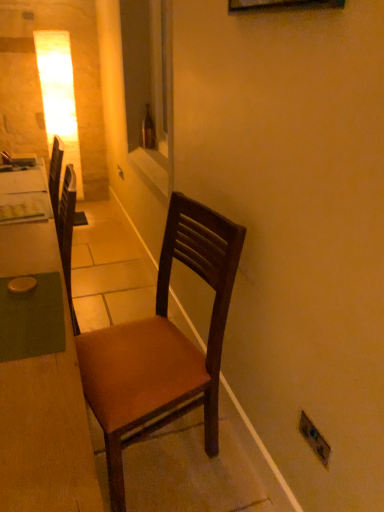
Question: Is brown leather chair at center further to camera compared to matte plastic electric outlet at lower right?

Choices:
 (A) no
 (B) yes

Answer: (A)

Question: From the image's perspective, is brown leather chair at center above matte plastic electric outlet at lower right?

Choices:
 (A) no
 (B) yes

Answer: (B)

Question: Can you confirm if brown leather chair at center is taller than matte plastic electric outlet at lower right?

Choices:
 (A) no
 (B) yes

Answer: (B)

Question: Does brown leather chair at center have a greater width compared to matte plastic electric outlet at lower right?

Choices:
 (A) yes
 (B) no

Answer: (A)

Question: Is brown leather chair at center shorter than matte plastic electric outlet at lower right?

Choices:
 (A) no
 (B) yes

Answer: (A)

Question: Is brown leather chair at center positioned in front of matte plastic electric outlet at lower right?

Choices:
 (A) no
 (B) yes

Answer: (B)

Question: From the image's perspective, is white glossy window sill at center under matte plastic electric outlet at lower right?

Choices:
 (A) no
 (B) yes

Answer: (A)

Question: Considering the relative sizes of white glossy window sill at center and matte plastic electric outlet at lower right in the image provided, is white glossy window sill at center taller than matte plastic electric outlet at lower right?

Choices:
 (A) yes
 (B) no

Answer: (B)

Question: Is white glossy window sill at center oriented away from matte plastic electric outlet at lower right?

Choices:
 (A) yes
 (B) no

Answer: (B)

Question: Is white glossy window sill at center positioned beyond the bounds of matte plastic electric outlet at lower right?

Choices:
 (A) yes
 (B) no

Answer: (A)

Question: Is white glossy window sill at center bigger than matte plastic electric outlet at lower right?

Choices:
 (A) no
 (B) yes

Answer: (B)

Question: From the image's perspective, is white glossy window sill at center on top of matte plastic electric outlet at lower right?

Choices:
 (A) no
 (B) yes

Answer: (B)

Question: Does brown glass bottle at center appear on the right side of brown leather chair at center?

Choices:
 (A) no
 (B) yes

Answer: (A)